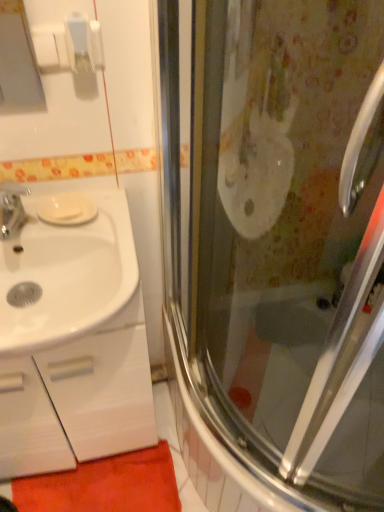
In order to face transparent glass shower door at right, should I rotate leftwards or rightwards?

A 22.191 degree turn to the right will do.

Image resolution: width=384 pixels, height=512 pixels. Describe the element at coordinates (277, 246) in the screenshot. I see `transparent glass shower door at right` at that location.

Image resolution: width=384 pixels, height=512 pixels. Describe the element at coordinates (78, 399) in the screenshot. I see `white glossy cabinet at left` at that location.

Where is `orange carpet at lower left`? The height and width of the screenshot is (512, 384). orange carpet at lower left is located at coordinates (105, 485).

Is white glossy sink at left next to white matte soap at left?

There is a gap between white glossy sink at left and white matte soap at left.

Is white glossy sink at left positioned with its back to white matte soap at left?

Yes, white glossy sink at left is positioned with its back facing white matte soap at left.

From a real-world perspective, is white glossy sink at left located beneath white matte soap at left?

Yes.

The height and width of the screenshot is (512, 384). Find the location of `sink in front of the white glossy cabinet at left`. sink in front of the white glossy cabinet at left is located at coordinates (66, 274).

Does white glossy cabinet at left have a smaller size compared to white glossy sink at left?

No.

How many degrees apart are the facing directions of white glossy cabinet at left and white glossy sink at left?

The angular difference between white glossy cabinet at left and white glossy sink at left is 0.118 degrees.

Does white glossy cabinet at left have a smaller size compared to transparent glass shower door at right?

Yes, white glossy cabinet at left is smaller than transparent glass shower door at right.

Is point (49, 389) less distant than point (383, 290)?

No, it is behind (383, 290).

Would you say white glossy cabinet at left is inside or outside transparent glass shower door at right?

white glossy cabinet at left cannot be found inside transparent glass shower door at right.

Can you confirm if white glossy cabinet at left is thinner than transparent glass shower door at right?

Indeed, white glossy cabinet at left has a lesser width compared to transparent glass shower door at right.

Considering the points (262, 415) and (22, 430), which point is behind, point (262, 415) or point (22, 430)?

Positioned behind is point (262, 415).

Does transparent glass shower door at right have a lesser width compared to white glossy cabinet at left?

In fact, transparent glass shower door at right might be wider than white glossy cabinet at left.

Which object is closer to the camera taking this photo, transparent glass shower door at right or white glossy cabinet at left?

transparent glass shower door at right is closer to the camera.

From a real-world perspective, who is located higher, transparent glass shower door at right or white glossy cabinet at left?

transparent glass shower door at right.

Is white matte soap at left directly adjacent to white glossy cabinet at left?

No, white matte soap at left is not in contact with white glossy cabinet at left.

Can you confirm if white matte soap at left is positioned to the right of white glossy cabinet at left?

Yes, white matte soap at left is to the right of white glossy cabinet at left.

Is white glossy cabinet at left surrounded by white matte soap at left?

Definitely not — white glossy cabinet at left is not inside white matte soap at left.

Looking at this image, does white matte soap at left have a smaller size compared to white glossy cabinet at left?

Correct, white matte soap at left occupies less space than white glossy cabinet at left.

Measure the distance between orange carpet at lower left and white glossy cabinet at left.

orange carpet at lower left and white glossy cabinet at left are 9.55 inches apart from each other.

From the image's perspective, which is above, orange carpet at lower left or white glossy cabinet at left?

white glossy cabinet at left.

In terms of height, does orange carpet at lower left look taller or shorter compared to white glossy cabinet at left?

Clearly, orange carpet at lower left is shorter compared to white glossy cabinet at left.

In the scene shown: Can you confirm if orange carpet at lower left is shorter than transparent glass shower door at right?

Correct, orange carpet at lower left is not as tall as transparent glass shower door at right.

From the image's perspective, between orange carpet at lower left and transparent glass shower door at right, which one is located above?

transparent glass shower door at right.

Considering the sizes of objects orange carpet at lower left and transparent glass shower door at right in the image provided, who is wider, orange carpet at lower left or transparent glass shower door at right?

transparent glass shower door at right is wider.

At what (x,y) coordinates should I click in order to perform the action: click on soap behind the white glossy sink at left. Please return your answer as a coordinate pair (x, y). Image resolution: width=384 pixels, height=512 pixels. Looking at the image, I should click on pyautogui.click(x=66, y=212).

This screenshot has height=512, width=384. In order to click on bathroom cabinet to the left of white glossy sink at left in this screenshot , I will do `click(78, 399)`.

Looking at the image, which one is located further to white matte soap at left, transparent glass shower door at right or white glossy sink at left?

The object further to white matte soap at left is transparent glass shower door at right.

Estimate the real-world distances between objects in this image. Which object is closer to transparent glass shower door at right, white glossy cabinet at left or orange carpet at lower left?

The object closer to transparent glass shower door at right is white glossy cabinet at left.

When comparing their distances from white glossy sink at left, does white matte soap at left or transparent glass shower door at right seem closer?

white matte soap at left is closer to white glossy sink at left.

Considering their positions, is white glossy cabinet at left positioned closer to white matte soap at left than orange carpet at lower left?

Based on the image, white glossy cabinet at left appears to be nearer to white matte soap at left.

From the image, which object appears to be farther from orange carpet at lower left, white glossy cabinet at left or white matte soap at left?

white matte soap at left.

Based on their spatial positions, is orange carpet at lower left or white matte soap at left closer to white glossy sink at left?

Among the two, white matte soap at left is located nearer to white glossy sink at left.

From the picture: Looking at the image, which one is located closer to transparent glass shower door at right, white matte soap at left or orange carpet at lower left?

orange carpet at lower left is positioned closer to the anchor transparent glass shower door at right.

From the image, which object appears to be nearer to transparent glass shower door at right, orange carpet at lower left or white matte soap at left?

orange carpet at lower left lies closer to transparent glass shower door at right than the other object.

What are the coordinates of `sink between transparent glass shower door at right and orange carpet at lower left in the front-back direction` in the screenshot? It's located at (66, 274).

You are a GUI agent. You are given a task and a screenshot of the screen. Output one action in this format:
    pyautogui.click(x=<x>, y=<y>)
    Task: Click on the bathroom cabinet between transparent glass shower door at right and white matte soap at left from front to back
    The image size is (384, 512).
    Given the screenshot: What is the action you would take?
    pyautogui.click(x=78, y=399)

The image size is (384, 512). I want to click on soap between transparent glass shower door at right and orange carpet at lower left in the front-back direction, so click(x=66, y=212).

Image resolution: width=384 pixels, height=512 pixels. I want to click on bathroom cabinet between white glossy sink at left and orange carpet at lower left from top to bottom, so click(78, 399).